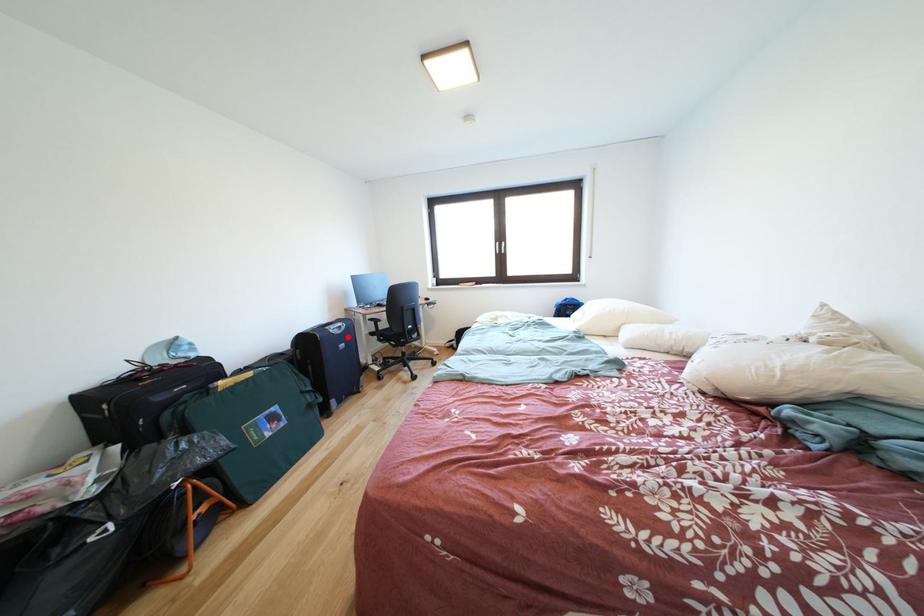
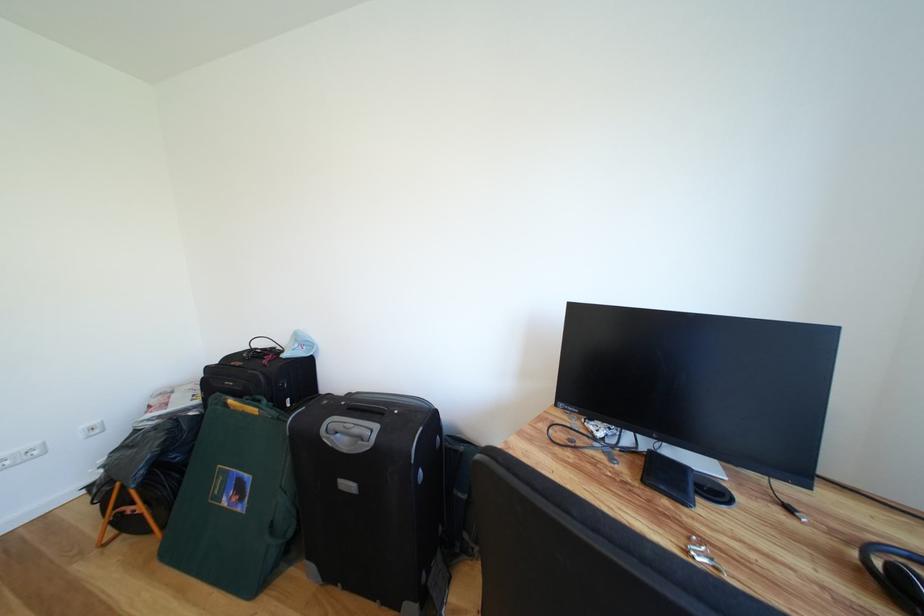
Locate, in the second image, the point that corresponds to the highlighted location in the first image.

(353, 455)